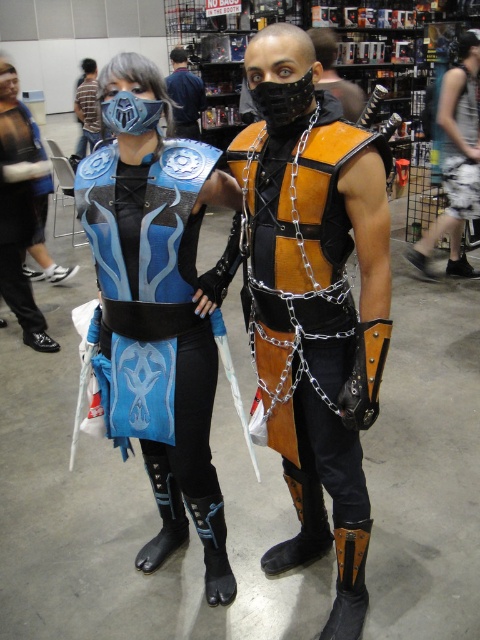
Question: Is matte blue armor at center wider than patterned fabric dress at center?

Choices:
 (A) no
 (B) yes

Answer: (B)

Question: Which object is farther from the camera taking this photo?

Choices:
 (A) orange leather vest at center
 (B) matte black mask at upper center
 (C) matte blue fabric vest at center

Answer: (B)

Question: Which object is the farthest from the matte black mask at upper center?

Choices:
 (A) matte black armor at left
 (B) matte black mask at upper left

Answer: (A)

Question: Is matte blue armor at center closer to camera compared to matte blue fabric vest at center?

Choices:
 (A) yes
 (B) no

Answer: (A)

Question: Which object is farther from the camera taking this photo?

Choices:
 (A) matte black mask at upper left
 (B) matte blue fabric vest at center
 (C) denim shorts at lower right

Answer: (A)

Question: Is matte blue fabric vest at center thinner than patterned fabric dress at center?

Choices:
 (A) yes
 (B) no

Answer: (B)